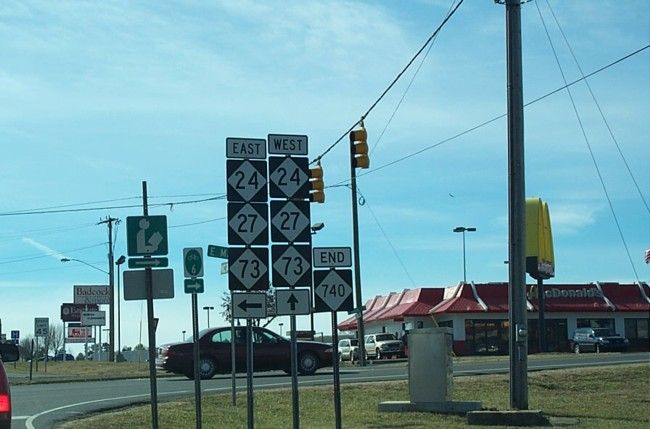
This screenshot has height=429, width=650. In order to click on wires in this screenshot , I will do `click(395, 78)`, `click(408, 91)`, `click(567, 82)`, `click(585, 75)`, `click(99, 205)`, `click(179, 227)`, `click(196, 204)`, `click(66, 252)`.